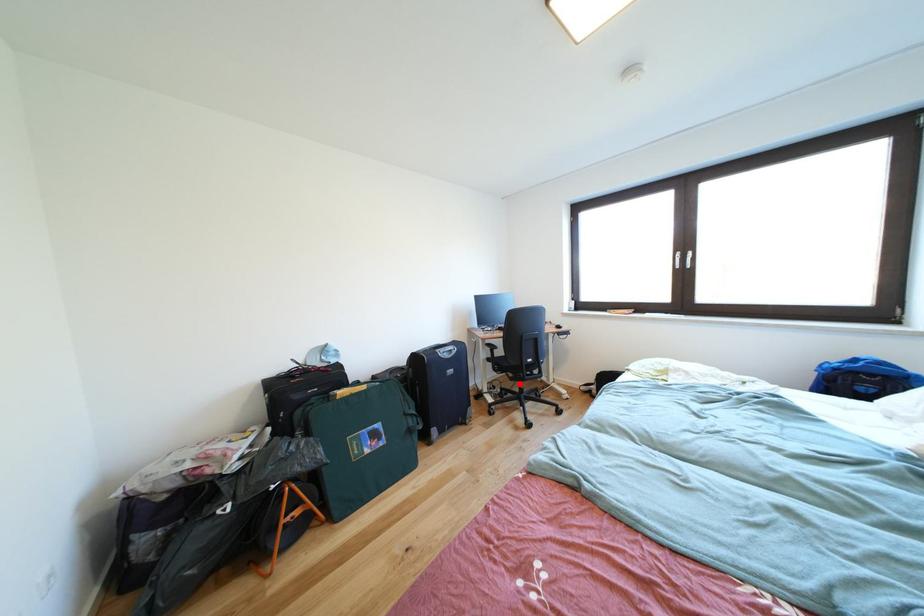
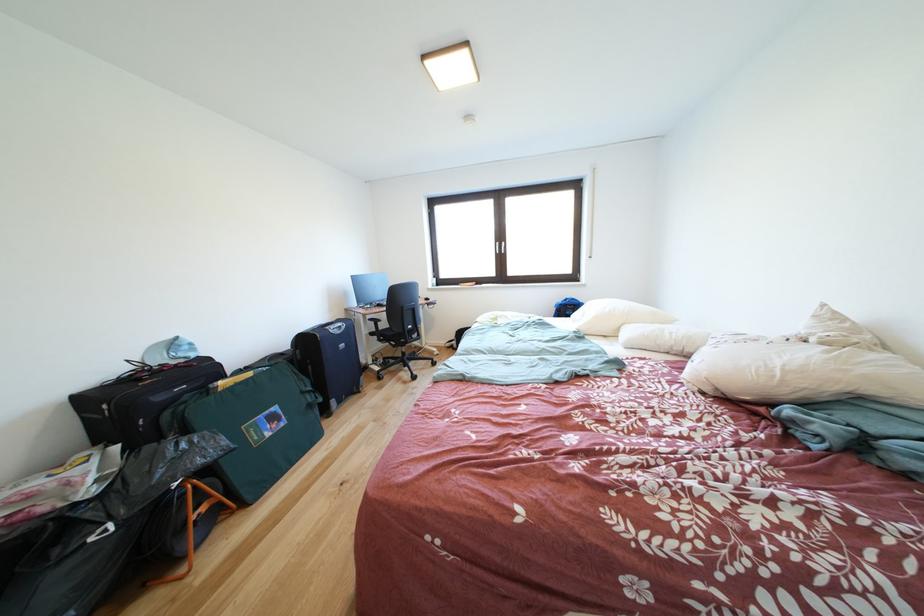
Locate, in the second image, the point that corresponds to the highlighted location in the first image.

(403, 351)